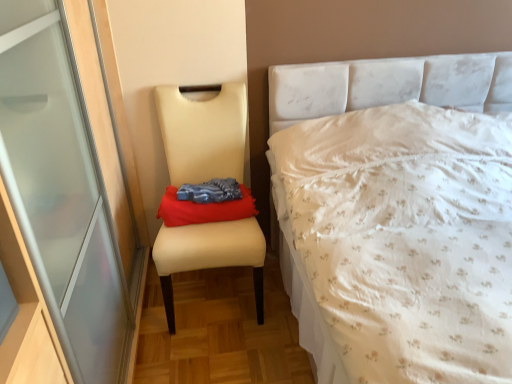
In order to click on red fabric cloth at center in this screenshot , I will do `click(204, 209)`.

From the image's perspective, does beige leather chair at left appear lower than red fabric cloth at center?

Yes, from the image's perspective, beige leather chair at left is below red fabric cloth at center.

How distant is beige leather chair at left from red fabric cloth at center?

beige leather chair at left is 10.58 inches away from red fabric cloth at center.

Consider the image. Considering the relative positions of beige leather chair at left and red fabric cloth at center in the image provided, is beige leather chair at left to the left or to the right of red fabric cloth at center?

In the image, beige leather chair at left appears on the left side of red fabric cloth at center.

In the scene shown: Can you confirm if white floral fabric bed at right is bigger than beige leather chair at left?

Correct, white floral fabric bed at right is larger in size than beige leather chair at left.

Considering the relative positions of white floral fabric bed at right and beige leather chair at left in the image provided, is white floral fabric bed at right to the left or to the right of beige leather chair at left?

In the image, white floral fabric bed at right appears on the right side of beige leather chair at left.

Considering the positions of point (462, 258) and point (249, 219), is point (462, 258) closer or farther from the camera than point (249, 219)?

Point (462, 258) appears to be closer to the viewer than point (249, 219).

From a real-world perspective, which is physically below, white floral fabric bed at right or beige leather chair at left?

In real-world perspective, beige leather chair at left is lower.

From a real-world perspective, which is physically below, beige leather chair at left or white floral fabric bed at right?

beige leather chair at left.

Is point (185, 130) closer or farther from the camera than point (399, 83)?

Clearly, point (185, 130) is closer to the camera than point (399, 83).

Find the location of a particular element. This screenshot has width=512, height=384. bed in front of the beige leather chair at left is located at coordinates (402, 226).

From the image's perspective, would you say beige leather chair at left is positioned over white floral fabric bed at right?

Yes, from the image's perspective, beige leather chair at left is on top of white floral fabric bed at right.

Is the position of red fabric cloth at center more distant than that of beige leather chair at left?

Yes, it is.

Could you tell me if red fabric cloth at center is facing beige leather chair at left?

Yes, red fabric cloth at center is facing beige leather chair at left.

Can you confirm if red fabric cloth at center is taller than beige leather chair at left?

Incorrect, the height of red fabric cloth at center is not larger of that of beige leather chair at left.

Considering the sizes of objects red fabric cloth at center and white floral fabric bed at right in the image provided, who is wider, red fabric cloth at center or white floral fabric bed at right?

Wider between the two is white floral fabric bed at right.

From the image's perspective, is red fabric cloth at center above or below white floral fabric bed at right?

Based on their image positions, red fabric cloth at center is located above white floral fabric bed at right.

How much distance is there between red fabric cloth at center and white floral fabric bed at right?

They are 23.90 inches apart.

Which is behind, point (221, 202) or point (453, 130)?

Point (221, 202)

Is white floral fabric bed at right positioned with its back to red fabric cloth at center?

No, red fabric cloth at center is not at the back of white floral fabric bed at right.

Is red fabric cloth at center a part of white floral fabric bed at right?

No, red fabric cloth at center is located outside of white floral fabric bed at right.

From the image's perspective, which object appears higher, white floral fabric bed at right or red fabric cloth at center?

red fabric cloth at center.

Which is farther, (478, 350) or (178, 207)?

The point (178, 207) is farther.

Where is `chair that is in front of the red fabric cloth at center`? chair that is in front of the red fabric cloth at center is located at coordinates (203, 133).

Where is `chair that is on the left side of white floral fabric bed at right`? The height and width of the screenshot is (384, 512). chair that is on the left side of white floral fabric bed at right is located at coordinates (203, 133).

Estimate the real-world distances between objects in this image. Which object is further from red fabric cloth at center, beige leather chair at left or white floral fabric bed at right?

white floral fabric bed at right is further to red fabric cloth at center.

From the picture: Considering their positions, is beige leather chair at left positioned closer to white floral fabric bed at right than red fabric cloth at center?

red fabric cloth at center.

From the image, which object appears to be nearer to beige leather chair at left, red fabric cloth at center or white floral fabric bed at right?

red fabric cloth at center lies closer to beige leather chair at left than the other object.

When comparing their distances from beige leather chair at left, does white floral fabric bed at right or red fabric cloth at center seem closer?

The object closer to beige leather chair at left is red fabric cloth at center.

From the image, which object appears to be nearer to white floral fabric bed at right, red fabric cloth at center or beige leather chair at left?

Based on the image, red fabric cloth at center appears to be nearer to white floral fabric bed at right.

Estimate the real-world distances between objects in this image. Which object is closer to red fabric cloth at center, white floral fabric bed at right or beige leather chair at left?

beige leather chair at left is positioned closer to the anchor red fabric cloth at center.

This screenshot has height=384, width=512. I want to click on material between beige leather chair at left and white floral fabric bed at right, so click(x=204, y=209).